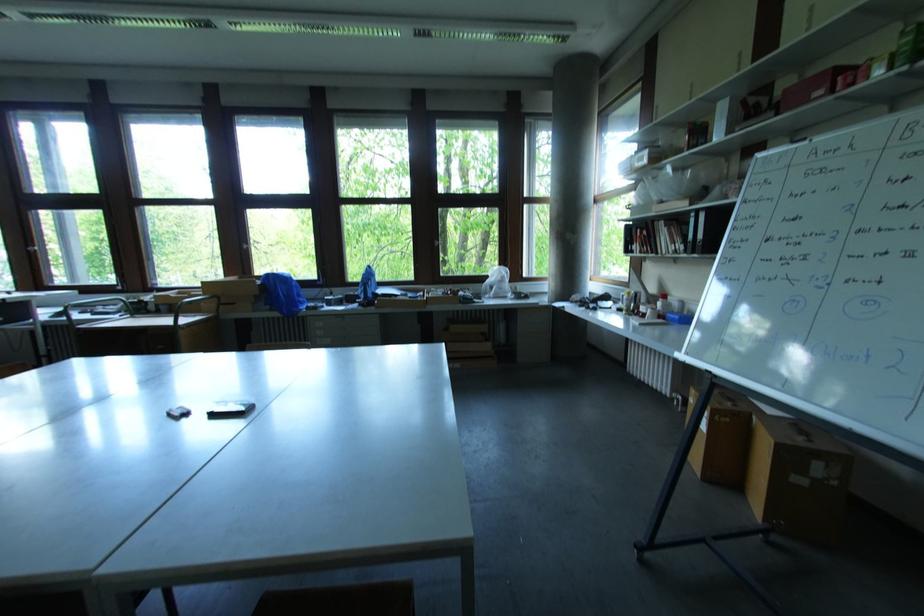
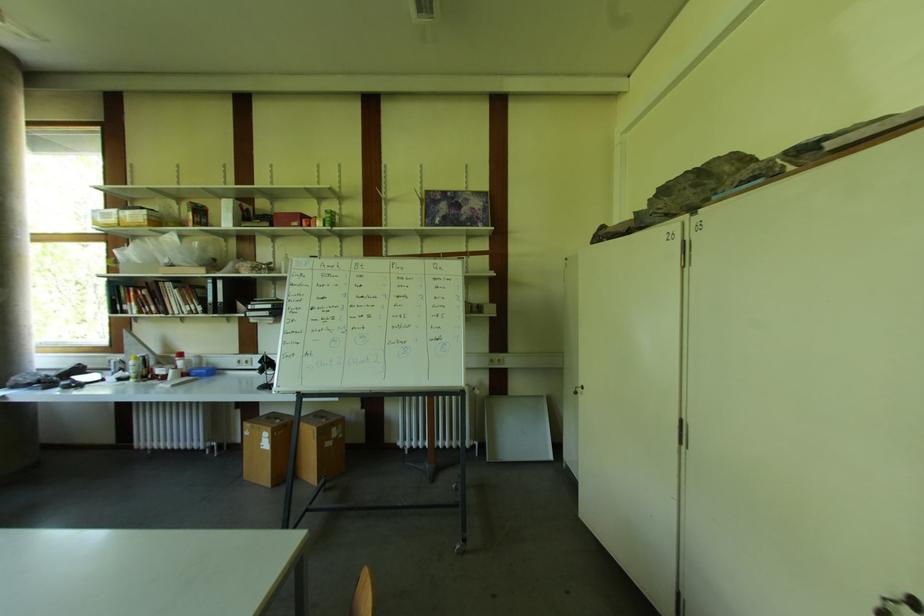
In the second image, find the point that corresponds to (688,151) in the first image.

(193, 225)